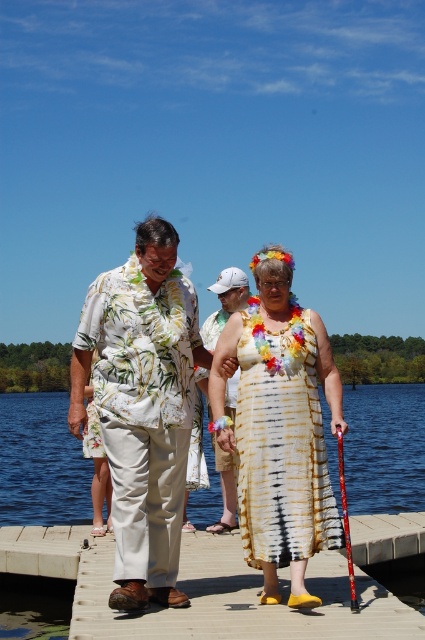
Is blue water at lower center below tie-dye fabric dress at center?

Answer: Yes, blue water at lower center is below tie-dye fabric dress at center.

Can you confirm if blue water at lower center is wider than tie-dye fabric dress at center?

Yes.

Identify the location of blue water at lower center. (40, 461).

Which is in front, point (150, 476) or point (31, 524)?

Point (150, 476) is more forward.

Image resolution: width=425 pixels, height=640 pixels. Describe the element at coordinates (141, 406) in the screenshot. I see `floral fabric shirt at center` at that location.

Identify the location of floral fabric shirt at center. The height and width of the screenshot is (640, 425). (141, 406).

Is wooden at center above white floral shirt at center?

No.

Does point (269, 611) come closer to viewer compared to point (221, 520)?

Yes, point (269, 611) is closer to viewer.

Who is more forward, (285, 618) or (229, 285)?

Point (285, 618)

Where is `wooden at center`? The image size is (425, 640). wooden at center is located at coordinates (204, 593).